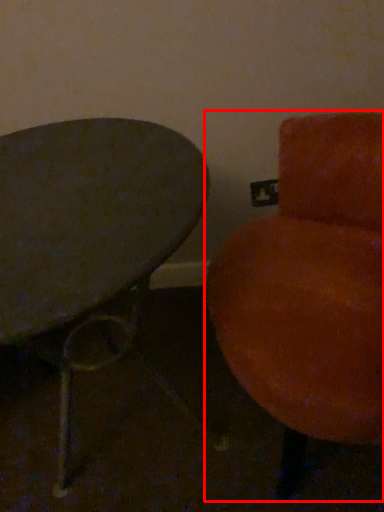
Question: In this image, where is chair (annotated by the red box) located relative to table?

Choices:
 (A) left
 (B) right

Answer: (B)